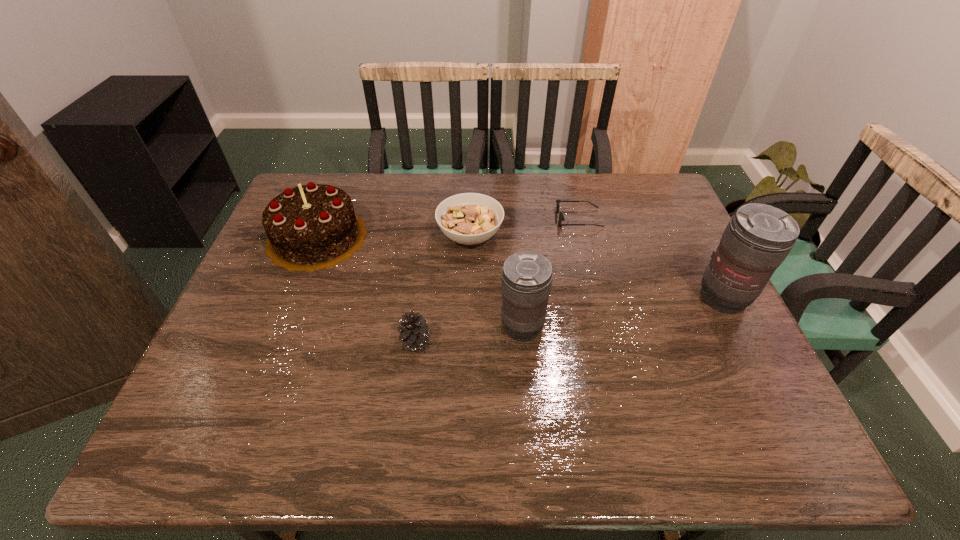
Locate an element on the screen. The height and width of the screenshot is (540, 960). sunglasses situated at the far edge is located at coordinates (561, 217).

In order to click on object located at the left edge in this screenshot , I will do `click(311, 227)`.

This screenshot has width=960, height=540. I want to click on object present at the right edge, so click(758, 238).

Image resolution: width=960 pixels, height=540 pixels. I want to click on object located at the far left corner, so click(x=311, y=227).

In the image, there is a desktop. Where is `blank space at the far edge`? The image size is (960, 540). blank space at the far edge is located at coordinates (408, 177).

Identify the location of blank space at the left edge of the desktop. The height and width of the screenshot is (540, 960). (223, 334).

In the image, there is a desktop. Where is `vacant region at the right edge`? The width and height of the screenshot is (960, 540). vacant region at the right edge is located at coordinates (707, 343).

The width and height of the screenshot is (960, 540). What are the coordinates of `vacant space at the far left corner of the desktop` in the screenshot? It's located at (338, 173).

The height and width of the screenshot is (540, 960). Find the location of `vacant region at the near left corner of the desktop`. vacant region at the near left corner of the desktop is located at coordinates (239, 396).

You are a GUI agent. You are given a task and a screenshot of the screen. Output one action in this format:
    pyautogui.click(x=<x>, y=<y>)
    Task: Click on the vacant area at the near right corner
    
    Given the screenshot: What is the action you would take?
    pyautogui.click(x=752, y=398)